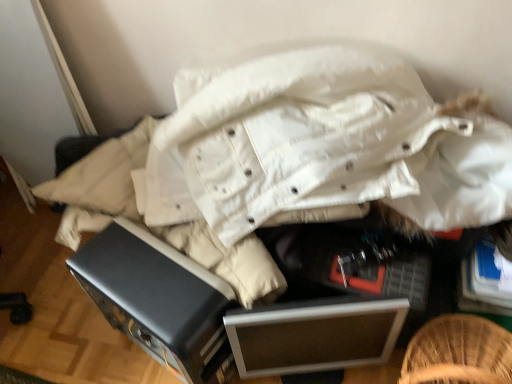
Question: Is black plastic drawer at center spatially inside silver metallic file cabinet at center, or outside of it?

Choices:
 (A) outside
 (B) inside

Answer: (A)

Question: Visually, is black plastic drawer at center positioned to the left or to the right of silver metallic file cabinet at center?

Choices:
 (A) right
 (B) left

Answer: (B)

Question: From the image's perspective, is black plastic drawer at center above or below silver metallic file cabinet at center?

Choices:
 (A) above
 (B) below

Answer: (A)

Question: In terms of width, does silver metallic file cabinet at center look wider or thinner when compared to black plastic drawer at center?

Choices:
 (A) thin
 (B) wide

Answer: (A)

Question: Choose the correct answer: Is silver metallic file cabinet at center inside black plastic drawer at center or outside it?

Choices:
 (A) inside
 (B) outside

Answer: (B)

Question: Does point (379, 324) appear closer or farther from the camera than point (326, 339)?

Choices:
 (A) farther
 (B) closer

Answer: (B)

Question: Relative to black plastic drawer at center, is silver metallic file cabinet at center in front or behind?

Choices:
 (A) front
 (B) behind

Answer: (B)